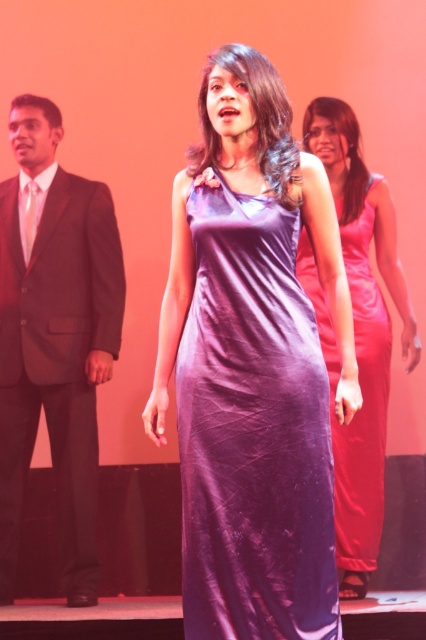
Is shiny black suit at left wider than purple satin dress at center?

Correct, the width of shiny black suit at left exceeds that of purple satin dress at center.

Is shiny black suit at left to the left of purple satin dress at center from the viewer's perspective?

Correct, you'll find shiny black suit at left to the left of purple satin dress at center.

Image resolution: width=426 pixels, height=640 pixels. In order to click on shiny black suit at left in this screenshot , I will do `click(54, 337)`.

Find the location of `shiny black suit at left`. shiny black suit at left is located at coordinates (54, 337).

From the picture: Does purple velvet dress at center appear on the left side of shiny black suit at left?

No, purple velvet dress at center is not to the left of shiny black suit at left.

Who is higher up, purple velvet dress at center or shiny black suit at left?

Positioned higher is shiny black suit at left.

What do you see at coordinates (253, 429) in the screenshot?
I see `purple velvet dress at center` at bounding box center [253, 429].

You are a GUI agent. You are given a task and a screenshot of the screen. Output one action in this format:
    pyautogui.click(x=<x>, y=<y>)
    Task: Click on the purple velvet dress at center
    The image size is (426, 640).
    Given the screenshot: What is the action you would take?
    pyautogui.click(x=253, y=429)

In the scene shown: Does purple velvet dress at center have a larger size compared to purple satin dress at center?

Incorrect, purple velvet dress at center is not larger than purple satin dress at center.

Is point (207, 528) positioned in front of point (331, 410)?

Yes, it is.

Identify the location of purple velvet dress at center. The image size is (426, 640). (253, 429).